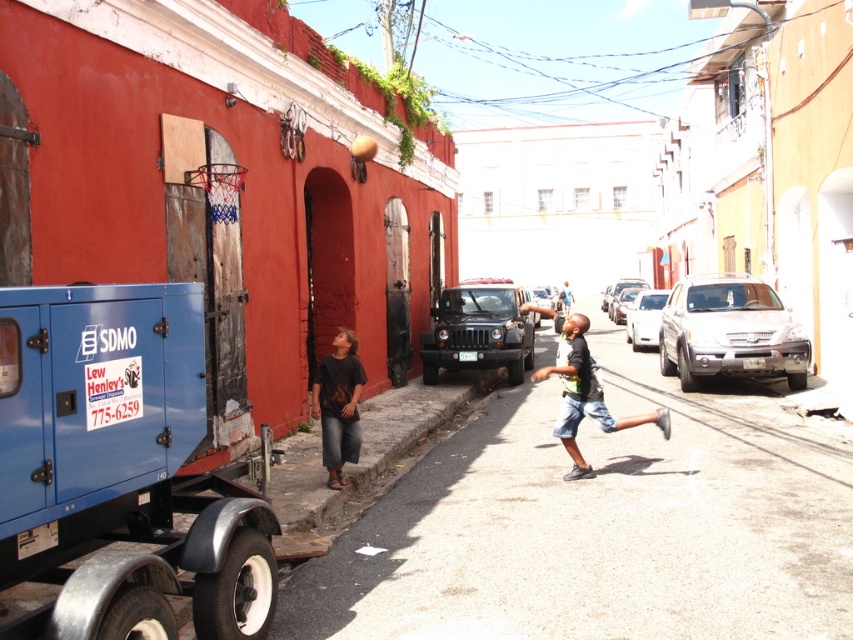
Question: Where is blue metallic generator at lower left located in relation to matte black suv at center in the image?

Choices:
 (A) right
 (B) left

Answer: (B)

Question: Which point is farther from the camera taking this photo?

Choices:
 (A) (128, 592)
 (B) (579, 403)

Answer: (B)

Question: Estimate the real-world distances between objects in this image. Which object is closer to the dark blue denim shorts at center?

Choices:
 (A) blue metallic generator at lower left
 (B) dark gray jeans at lower left

Answer: (B)

Question: Is matte black suv at center smaller than dark blue denim shorts at center?

Choices:
 (A) yes
 (B) no

Answer: (A)

Question: Which point is farther to the camera?

Choices:
 (A) black t-shirt at center
 (B) matte black suv at center
 (C) dark blue denim shorts at center

Answer: (B)

Question: Can you confirm if black t-shirt at center is thinner than matte black suv at center?

Choices:
 (A) no
 (B) yes

Answer: (A)